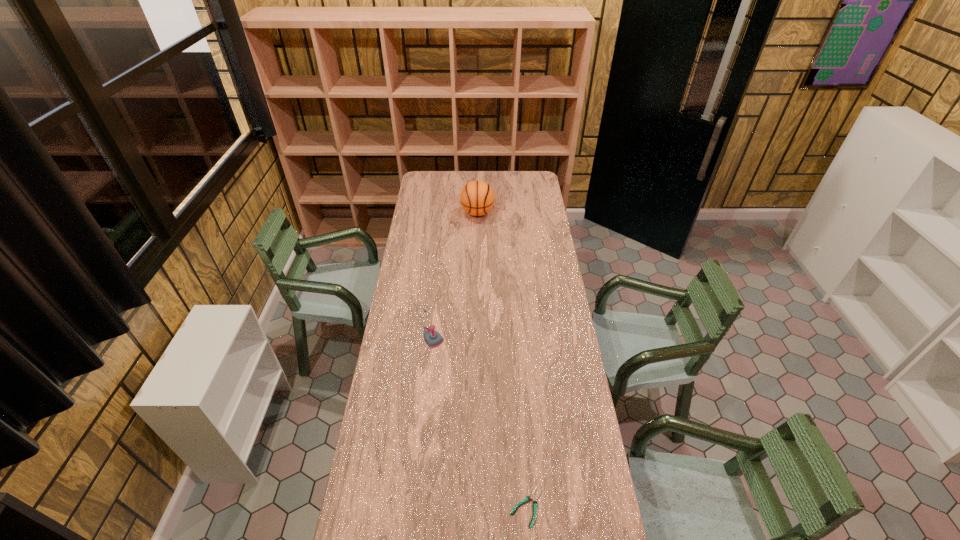
In the image, there is a desktop. Identify the location of blank space at the far edge. Image resolution: width=960 pixels, height=540 pixels. (514, 171).

Where is `vacant position at the left edge of the desktop`? This screenshot has height=540, width=960. vacant position at the left edge of the desktop is located at coordinates (431, 228).

The width and height of the screenshot is (960, 540). I want to click on vacant space at the right edge of the desktop, so click(x=544, y=216).

In the image, there is a desktop. Where is `vacant region at the far left corner`? The width and height of the screenshot is (960, 540). vacant region at the far left corner is located at coordinates click(x=421, y=184).

Where is `vacant space at the far right corner of the desktop`? vacant space at the far right corner of the desktop is located at coordinates (544, 190).

You are a GUI agent. You are given a task and a screenshot of the screen. Output one action in this format:
    pyautogui.click(x=<x>, y=<y>)
    Task: Click on the free area in between the pliers and the basketball
    The height and width of the screenshot is (540, 960).
    Given the screenshot: What is the action you would take?
    pyautogui.click(x=502, y=360)

Locate an element on the screen. The width and height of the screenshot is (960, 540). free space between the shortest object and the farthest object is located at coordinates (502, 360).

Where is `unoccupied position between the second nearest object and the farthest object`? This screenshot has width=960, height=540. unoccupied position between the second nearest object and the farthest object is located at coordinates (453, 269).

In order to click on vacant area that lies between the rightmost object and the second object from right to left in this screenshot , I will do `click(502, 360)`.

Point out which object is positioned as the nearest to the basketball. Please provide its 2D coordinates. Your answer should be formatted as a tuple, i.e. [(x, y)], where the tuple contains the x and y coordinates of a point satisfying the conditions above.

[(433, 339)]